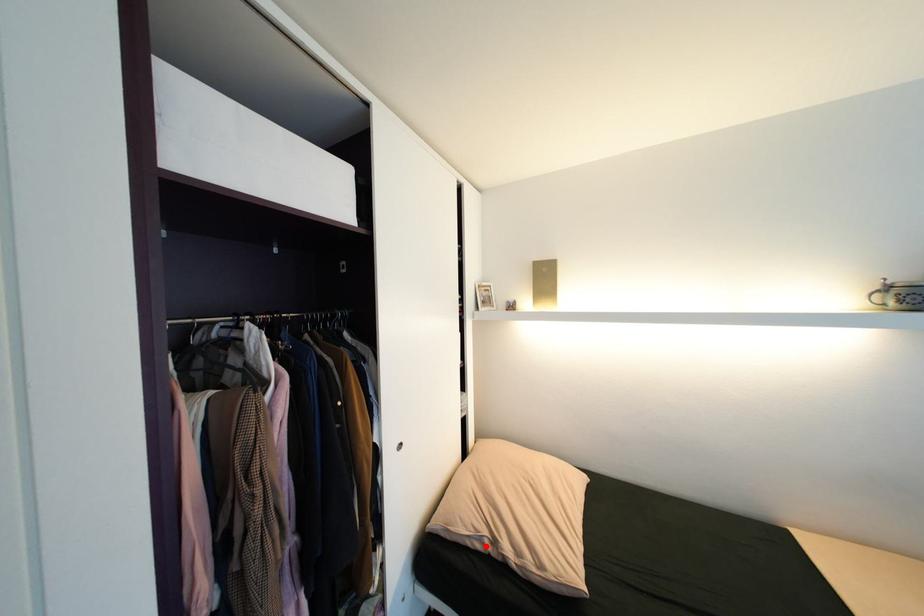
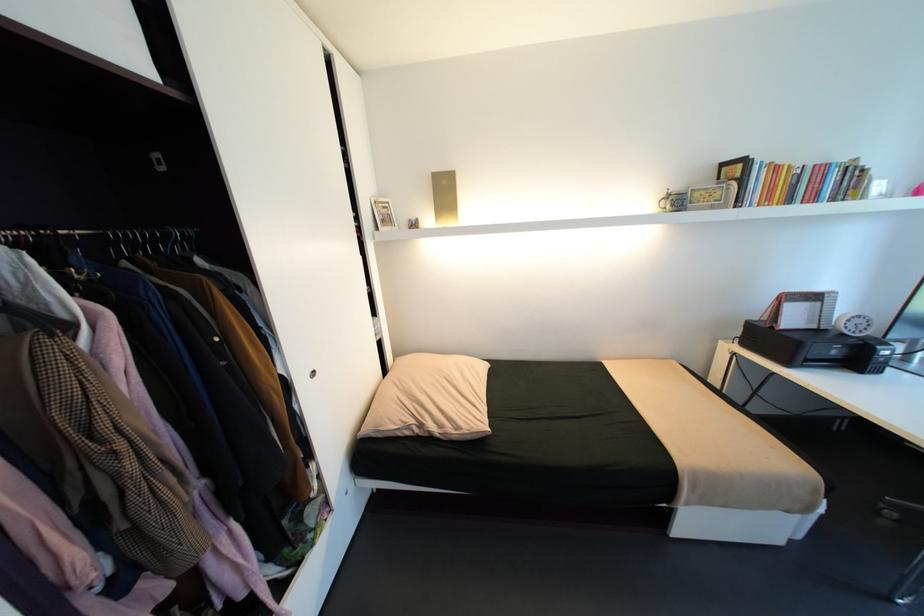
Locate, in the second image, the point that corresponds to the highlighted location in the first image.

(415, 432)